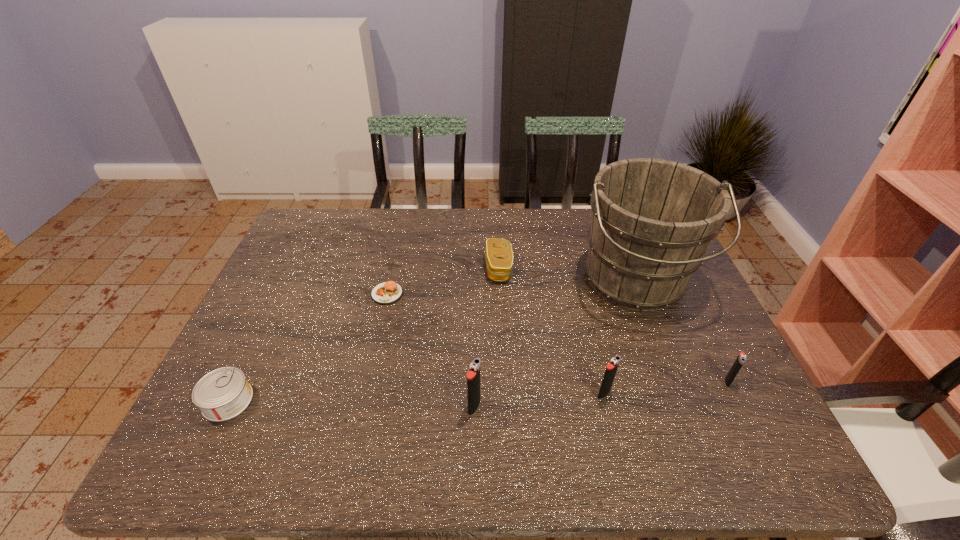
Locate an element on the screen. Image resolution: width=960 pixels, height=540 pixels. the tallest object is located at coordinates (652, 221).

Where is `can`? The width and height of the screenshot is (960, 540). can is located at coordinates (224, 393).

In order to click on the leftmost object in this screenshot , I will do `click(224, 393)`.

This screenshot has width=960, height=540. Find the location of `vacant space situated on the back of the leftmost igniter`. vacant space situated on the back of the leftmost igniter is located at coordinates (475, 361).

This screenshot has height=540, width=960. I want to click on vacant space located on the left of the second igniter from left to right, so click(558, 394).

Locate an element on the screen. The image size is (960, 540). free space located on the left of the shortest igniter is located at coordinates (596, 382).

This screenshot has height=540, width=960. In order to click on vacant space positioned on the zipper side of the fourth object from left to right in this screenshot , I will do tap(422, 268).

Locate an element on the screen. This screenshot has width=960, height=540. vacant area located on the zipper side of the fourth object from left to right is located at coordinates (412, 268).

I want to click on free space located on the zipper side of the fourth object from left to right, so click(x=448, y=268).

Locate an element on the screen. This screenshot has width=960, height=540. vacant region located on the back of the shortest object is located at coordinates (397, 249).